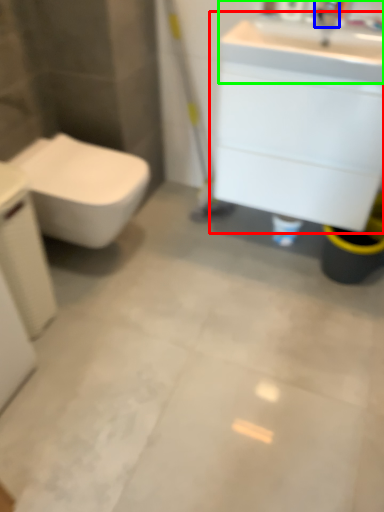
Question: Which object is positioned farthest from bathroom cabinet (highlighted by a red box)? Select from faucet (highlighted by a blue box) and sink (highlighted by a green box).

Choices:
 (A) faucet
 (B) sink

Answer: (A)